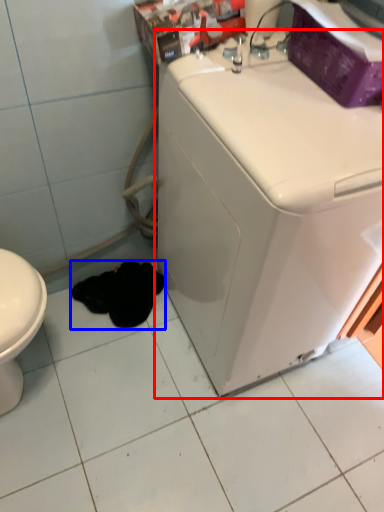
Question: Which of the following is the farthest to the observer, washing machine (highlighted by a red box) or animal (highlighted by a blue box)?

Choices:
 (A) washing machine
 (B) animal

Answer: (B)